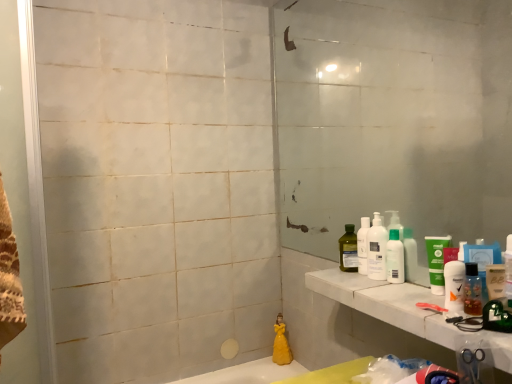
Find the location of a particular element. The height and width of the screenshot is (384, 512). vacant space behind translucent plastic bottle at right, the 1th mouthwash viewed from the front is located at coordinates (405, 293).